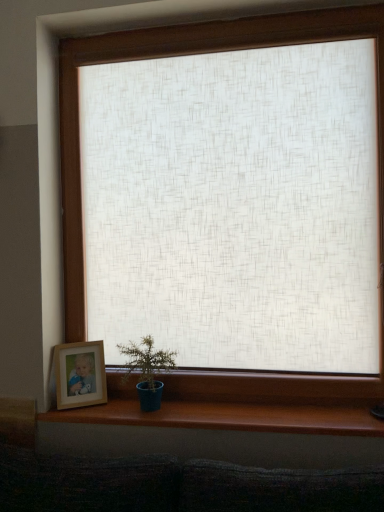
Question: Does wooden picture frame at lower left have a lesser height compared to brown wood at lower center?

Choices:
 (A) yes
 (B) no

Answer: (B)

Question: From a real-world perspective, is wooden picture frame at lower left under brown wood at lower center?

Choices:
 (A) no
 (B) yes

Answer: (A)

Question: Would you say wooden picture frame at lower left is a long distance from brown wood at lower center?

Choices:
 (A) no
 (B) yes

Answer: (A)

Question: Is brown wood at lower center located within wooden picture frame at lower left?

Choices:
 (A) yes
 (B) no

Answer: (B)

Question: Is wooden picture frame at lower left located outside brown wood at lower center?

Choices:
 (A) yes
 (B) no

Answer: (A)

Question: Can you confirm if wooden picture frame at lower left is thinner than brown wood at lower center?

Choices:
 (A) no
 (B) yes

Answer: (B)

Question: Does wooden picture frame at lower left have a lesser height compared to blue matte pot at lower left?

Choices:
 (A) no
 (B) yes

Answer: (B)

Question: Does wooden picture frame at lower left contain blue matte pot at lower left?

Choices:
 (A) no
 (B) yes

Answer: (A)

Question: Does wooden picture frame at lower left appear on the left side of blue matte pot at lower left?

Choices:
 (A) yes
 (B) no

Answer: (A)

Question: Is blue matte pot at lower left at the back of wooden picture frame at lower left?

Choices:
 (A) yes
 (B) no

Answer: (B)

Question: From a real-world perspective, is wooden picture frame at lower left located beneath blue matte pot at lower left?

Choices:
 (A) no
 (B) yes

Answer: (B)

Question: Is wooden picture frame at lower left taller than blue matte pot at lower left?

Choices:
 (A) no
 (B) yes

Answer: (A)

Question: Does blue matte pot at lower left come behind brown wood at lower center?

Choices:
 (A) no
 (B) yes

Answer: (B)